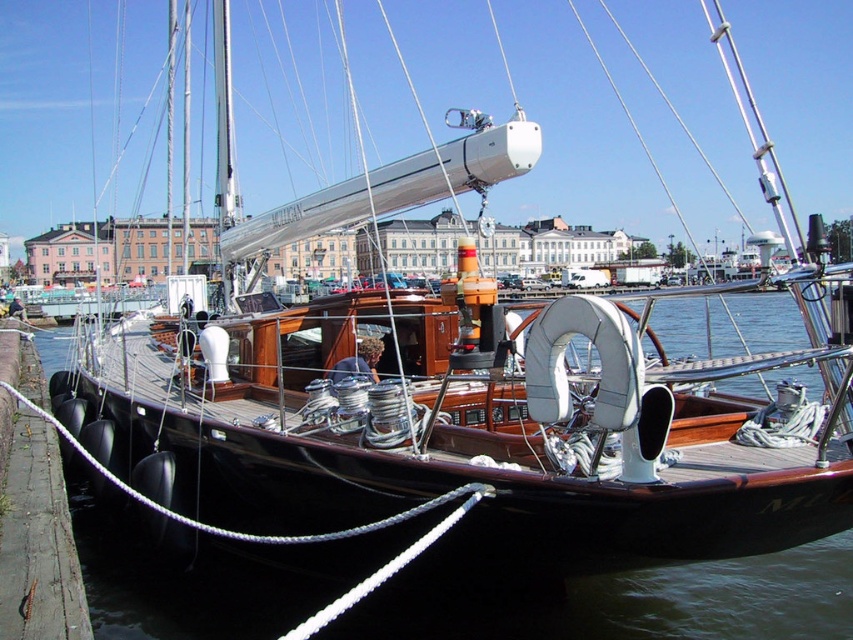
Which is more to the right, black wood boat at center or concrete at lower left?

Positioned to the right is black wood boat at center.

The width and height of the screenshot is (853, 640). Describe the element at coordinates (698, 602) in the screenshot. I see `black wood boat at center` at that location.

Find the location of a particular element. black wood boat at center is located at coordinates (698, 602).